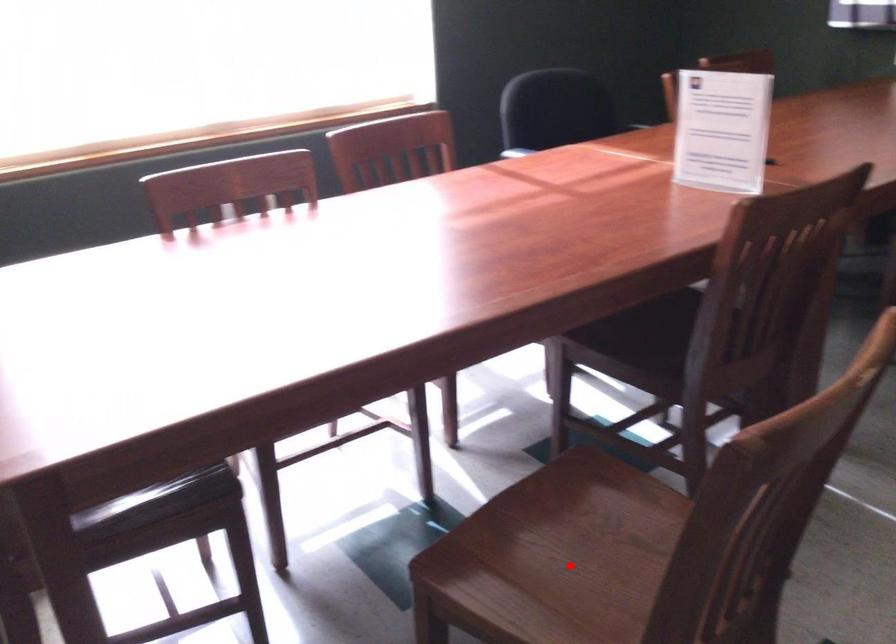
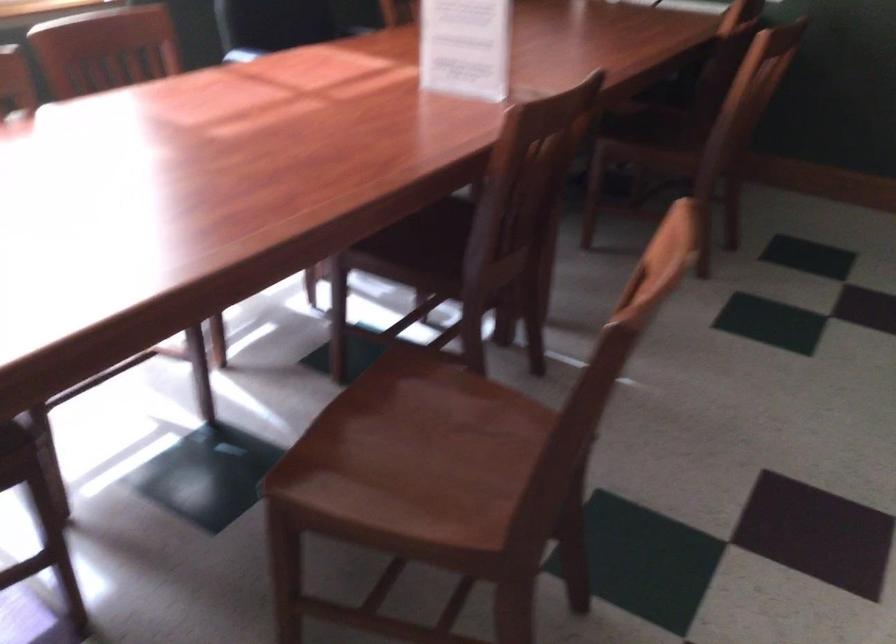
Where in the second image is the point corresponding to the highlighted location from the first image?

(412, 458)